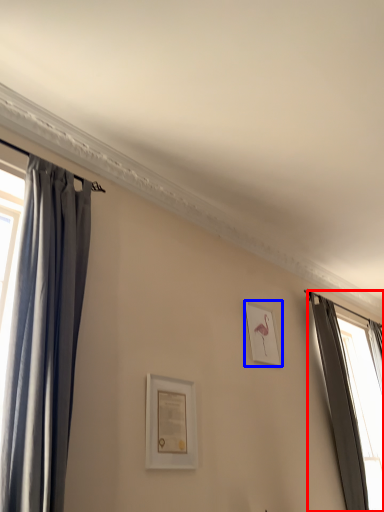
Question: Which object is further to the camera taking this photo, curtain (highlighted by a red box) or picture frame (highlighted by a blue box)?

Choices:
 (A) curtain
 (B) picture frame

Answer: (B)